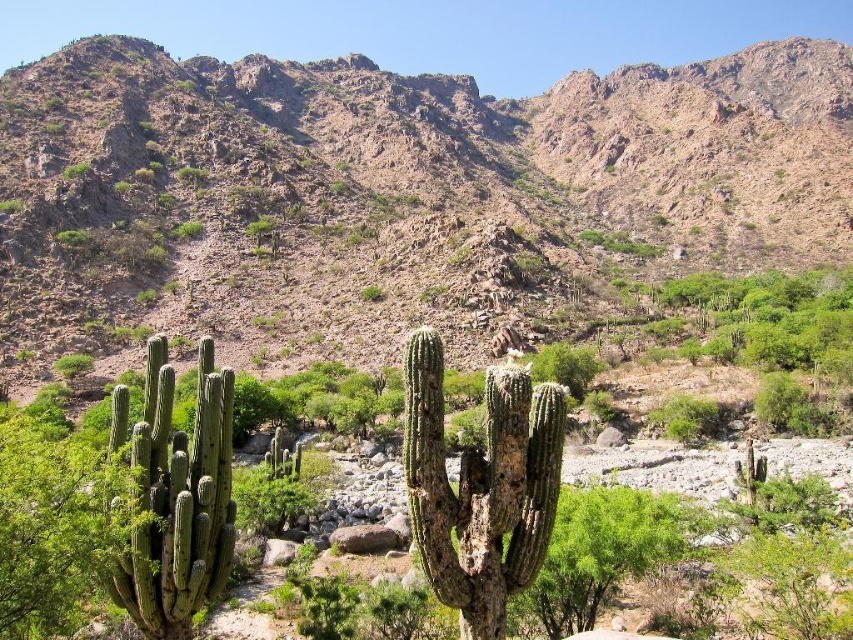
Question: Can you confirm if rugged rock mountain at upper center is smaller than green rough cactus at left?

Choices:
 (A) yes
 (B) no

Answer: (B)

Question: Is green rough cactus at center smaller than green rough cactus at left?

Choices:
 (A) no
 (B) yes

Answer: (B)

Question: Among these objects, which one is nearest to the camera?

Choices:
 (A) green rough cactus at left
 (B) rugged rock mountain at upper center
 (C) green rough cactus at center

Answer: (C)

Question: Where is rugged rock mountain at upper center located in relation to green rough cactus at left in the image?

Choices:
 (A) above
 (B) below

Answer: (A)

Question: Which point appears closest to the camera in this image?

Choices:
 (A) (177, 497)
 (B) (469, 618)
 (C) (674, 243)

Answer: (B)

Question: Which object is the farthest from the green rough cactus at center?

Choices:
 (A) green rough cactus at left
 (B) rugged rock mountain at upper center

Answer: (B)